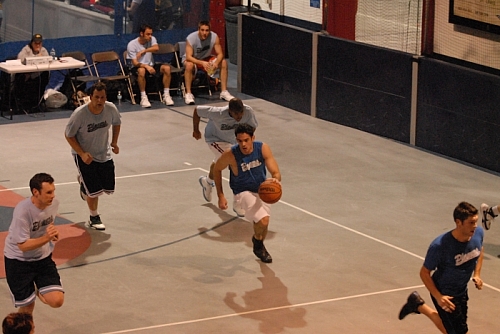
You are a GUI agent. You are given a task and a screenshot of the screen. Output one action in this format:
    pyautogui.click(x=<x>, y=<y>)
    Task: Click on the chairs
    The width and height of the screenshot is (500, 334).
    Given the screenshot: What is the action you would take?
    pyautogui.click(x=85, y=78), pyautogui.click(x=111, y=80), pyautogui.click(x=124, y=59), pyautogui.click(x=162, y=49), pyautogui.click(x=175, y=47)